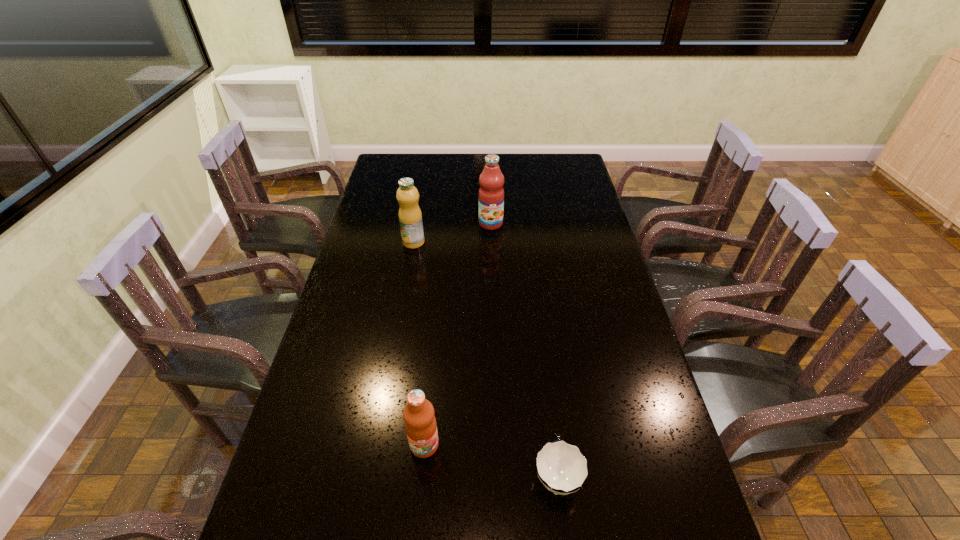
What are the coordinates of `vacant space in between the rightmost fruit juice and the nearest fruit juice` in the screenshot? It's located at (458, 334).

Where is `vacant region between the farthest fruit juice and the second shortest object`? vacant region between the farthest fruit juice and the second shortest object is located at coordinates (458, 334).

Where is `object that is the third closest one to the rightmost object`? object that is the third closest one to the rightmost object is located at coordinates (491, 193).

Where is `object that is the closest to the rightmost object`? object that is the closest to the rightmost object is located at coordinates (420, 423).

The height and width of the screenshot is (540, 960). I want to click on the third closest fruit juice relative to the cup, so click(x=491, y=193).

What are the coordinates of `the third closest fruit juice relative to the cup` in the screenshot? It's located at (491, 193).